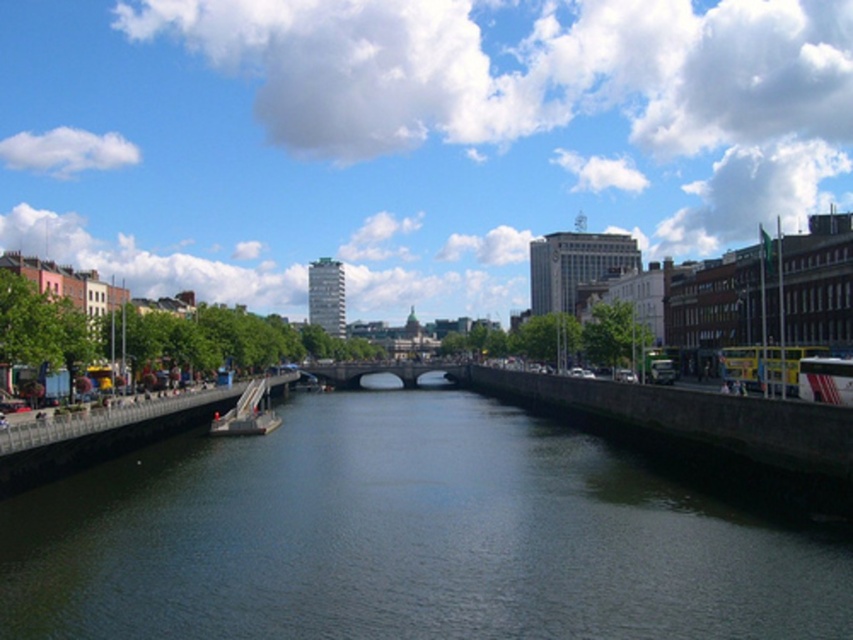
Which of these two, blue sky at upper center or dark gray stone bridge at center, stands taller?

blue sky at upper center is taller.

Based on the photo, can you confirm if blue sky at upper center is positioned to the right of dark gray stone bridge at center?

Correct, you'll find blue sky at upper center to the right of dark gray stone bridge at center.

Who is more distant from viewer, (747, 64) or (302, 365)?

The point (747, 64) is behind.

This screenshot has height=640, width=853. I want to click on blue sky at upper center, so click(x=409, y=136).

Can you confirm if dark blue water at center is smaller than metallic gray boat at center?

Actually, dark blue water at center might be larger than metallic gray boat at center.

Which is behind, point (471, 636) or point (222, 419)?

Point (222, 419)

Identify the location of dark blue water at center. (405, 538).

Between point (366, 368) and point (265, 378), which one is positioned in front?

Point (265, 378) is more forward.

Is point (347, 384) positioned after point (258, 432)?

Yes, it is behind point (258, 432).

The height and width of the screenshot is (640, 853). What are the coordinates of `dark gray stone bridge at center` in the screenshot? It's located at (375, 371).